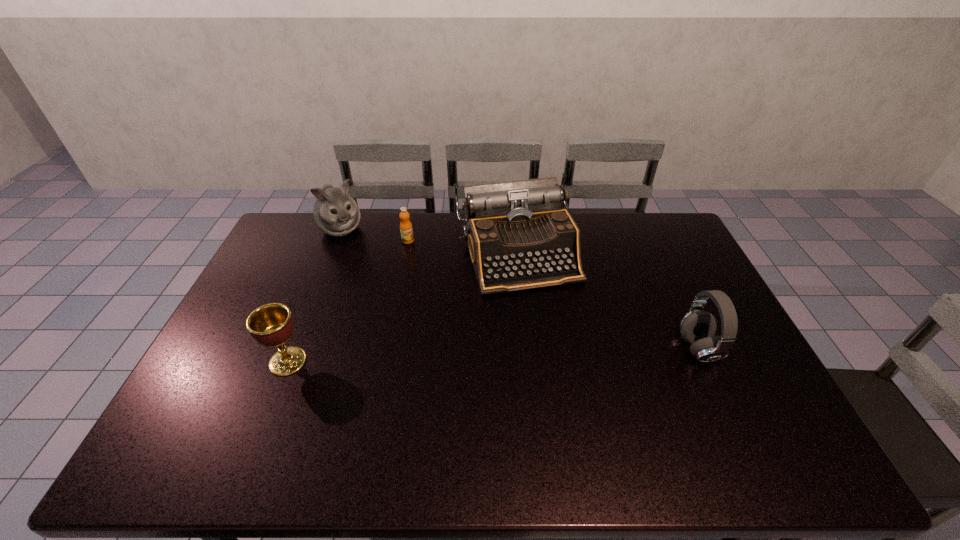
The image size is (960, 540). I want to click on chalice, so click(x=271, y=325).

Where is `the rightmost object`? The width and height of the screenshot is (960, 540). the rightmost object is located at coordinates (698, 327).

This screenshot has width=960, height=540. I want to click on typewriter, so click(519, 237).

At what (x,y) coordinates should I click in order to perform the action: click on the third object from right to left. Please return your answer as a coordinate pair (x, y). Looking at the image, I should click on (406, 230).

At what (x,y) coordinates should I click in order to perform the action: click on the shortest object. Please return your answer as a coordinate pair (x, y). Looking at the image, I should click on (406, 230).

Where is `hamster`? This screenshot has width=960, height=540. hamster is located at coordinates (335, 213).

Find the location of a particular element. blank space located 0.140m on the back of the chalice is located at coordinates (308, 310).

Where is `vacant space situated on the ear cups of the headset`? The width and height of the screenshot is (960, 540). vacant space situated on the ear cups of the headset is located at coordinates (620, 349).

Locate an element on the screen. vacant region located on the ear cups of the headset is located at coordinates (540, 349).

Locate an element on the screen. vacant space located on the ear cups of the headset is located at coordinates (564, 349).